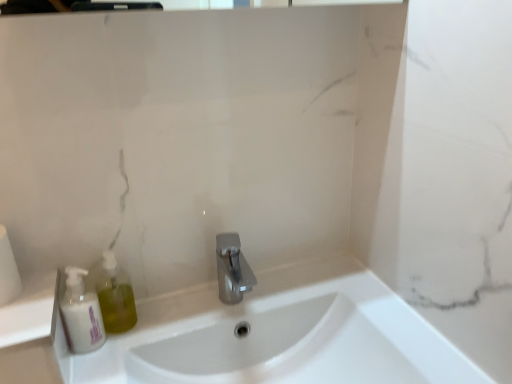
What are the coordinates of `vacant space to the right of polished metallic faucet at center` in the screenshot? It's located at (317, 291).